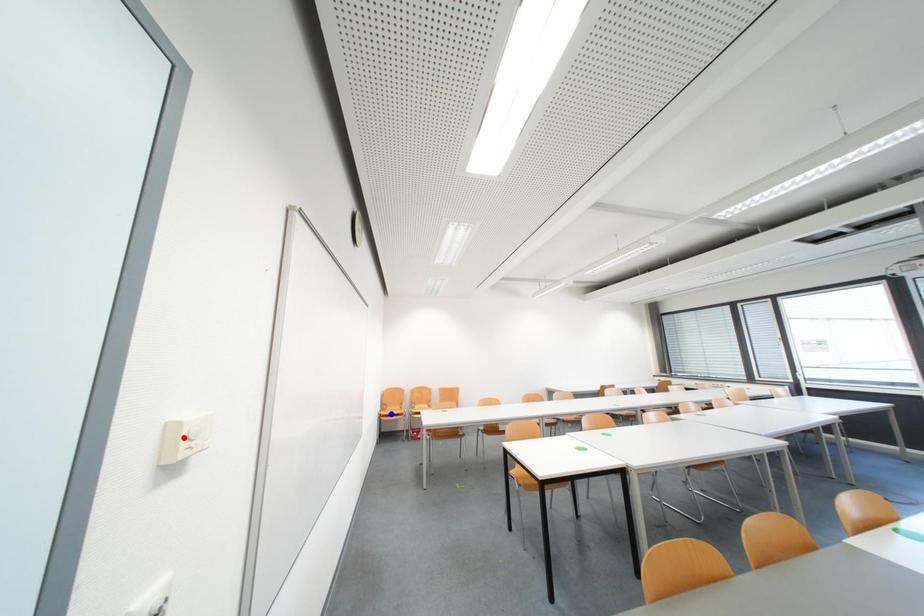
Question: In the image, two points are highlighted. Which point is nearer to the camera? Reply with the corresponding letter.

Choices:
 (A) blue point
 (B) red point

Answer: (B)